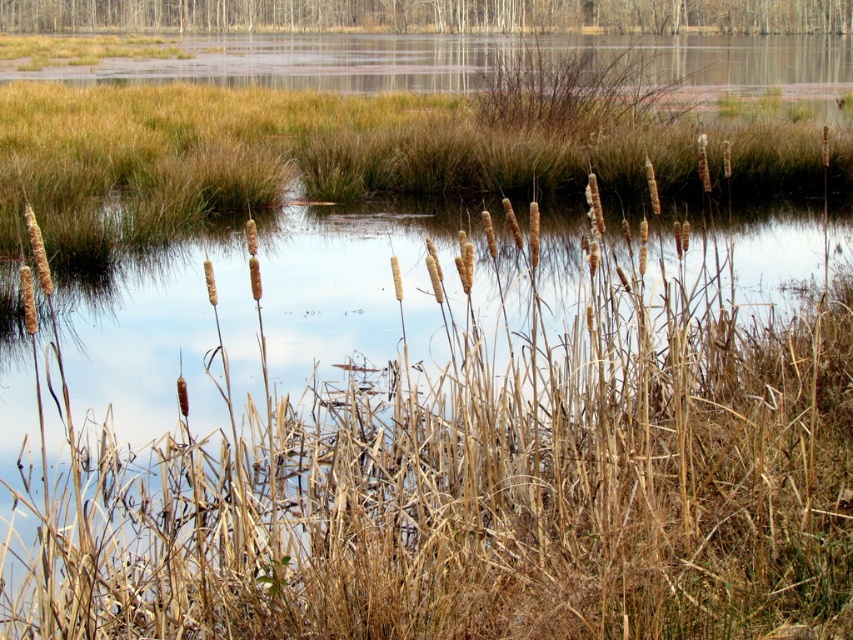
Question: Among these objects, which one is nearest to the camera?

Choices:
 (A) brown dry grass at center
 (B) dry grass at upper center
 (C) brown wood tree at upper center

Answer: (A)

Question: Is brown dry grass at center positioned behind brown wood tree at upper center?

Choices:
 (A) yes
 (B) no

Answer: (B)

Question: Which object is the farthest from the brown wood tree at upper center?

Choices:
 (A) brown dry grass at center
 (B) dry grass at upper center

Answer: (A)

Question: Which of these objects is positioned closest to the brown wood tree at upper center?

Choices:
 (A) brown dry grass at center
 (B) dry grass at upper center

Answer: (B)

Question: Is the position of brown dry grass at center less distant than that of dry grass at upper center?

Choices:
 (A) no
 (B) yes

Answer: (B)

Question: Is dry grass at upper center positioned in front of brown wood tree at upper center?

Choices:
 (A) yes
 (B) no

Answer: (A)